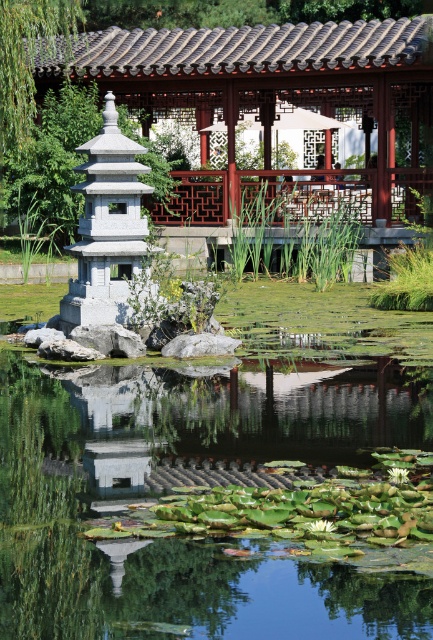
You are a gardener planning to place a new decorative rock in the scene. The rock is 2 meters wide. You want to place it either in the green glossy pond at center or under the wooden lattice gazebo at upper center. Based on their widths, which location can accommodate the rock without overcrowding?

The wooden lattice gazebo at upper center has a greater width than the green glossy pond at center, so placing the 2 meter wide rock under the wooden lattice gazebo at upper center would be more appropriate as it has sufficient space.